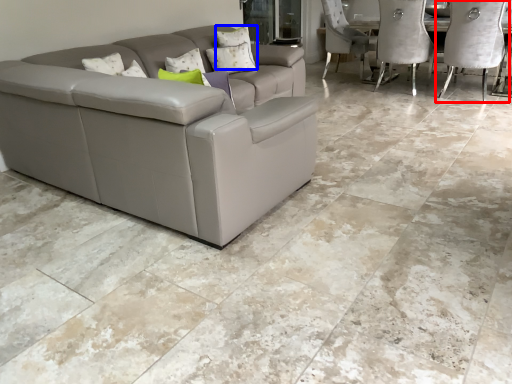
Question: Which point is further to the camera, chair (highlighted by a red box) or pillow (highlighted by a blue box)?

Choices:
 (A) chair
 (B) pillow

Answer: (B)